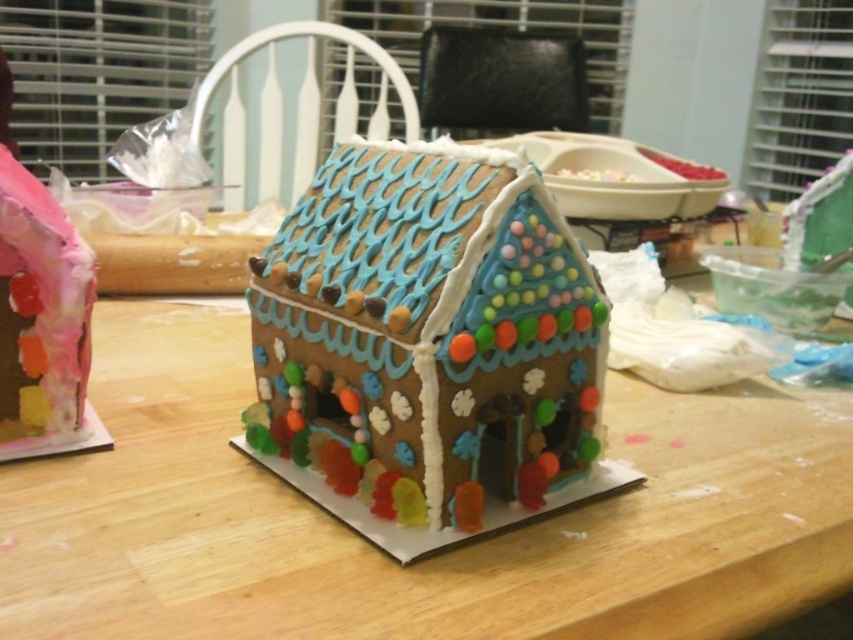
You are standing at the origin point of the coordinate system. You want to move towards the wooden table at center. What direction should you move in?

The wooden table at center is located at coordinate point 0.873 on the x axis and 0.502 on the y axis. Since you are at the origin, you should move in the positive x and positive y direction to reach the wooden table at center.